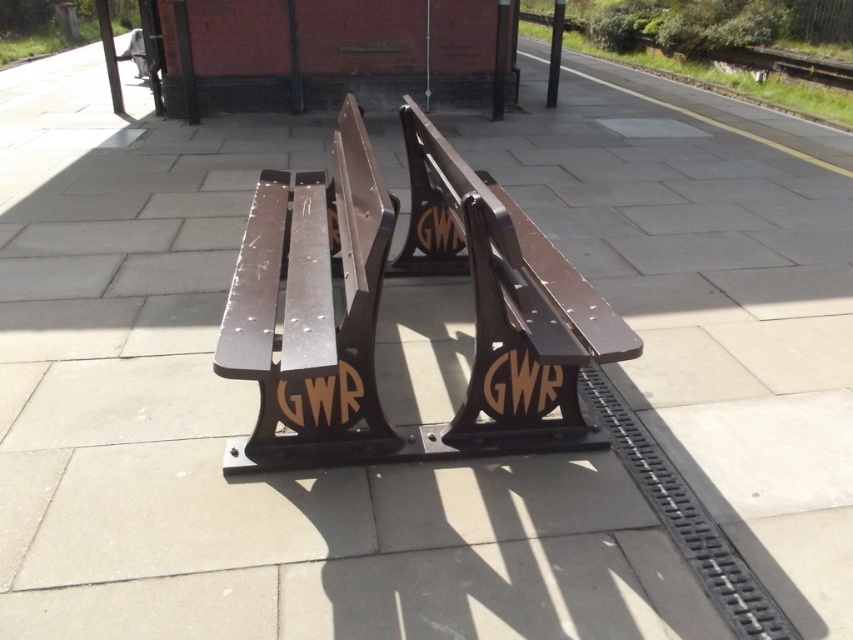
You are a maintenance worker at the station and need to replace a bench. You have a new bench that is 1.2 meters tall. The existing benches are the metallic brown bench at center and the brown polished wood bench at center. Which existing bench should you compare the height of the new bench to to ensure it matches the correct one?

The metallic brown bench at center is much taller than the brown polished wood bench at center. Since the new bench is 1.2 meters tall, you should compare it to the metallic brown bench at center to ensure height compatibility.

You are a maintenance worker checking the benches on the platform. You need to inspect the metallic brown bench at center and the brown polished wood bench at center. Which bench is positioned higher from the ground?

The metallic brown bench at center is located above the brown polished wood bench at center, so it is positioned higher from the ground.

You are standing at the edge of the platform near the drainage channel and want to take a photo of the metallic brown bench at center with your camera. Can you reach the bench within your camera range of 2 meters?

The metallic brown bench at center and camera are 1.82 meters apart, so yes, the camera can capture the bench within its 2 meters range.